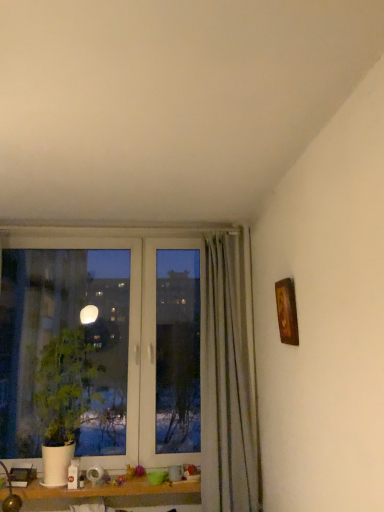
Question: From a real-world perspective, is wooden frame at upper right above or below white matte pot at left?

Choices:
 (A) above
 (B) below

Answer: (A)

Question: Relative to white matte pot at left, is wooden frame at upper right in front or behind?

Choices:
 (A) behind
 (B) front

Answer: (B)

Question: Looking at the image, does wooden frame at upper right seem bigger or smaller compared to white matte pot at left?

Choices:
 (A) small
 (B) big

Answer: (A)

Question: From a real-world perspective, is white matte pot at left physically located above or below wooden frame at upper right?

Choices:
 (A) below
 (B) above

Answer: (A)

Question: From the image's perspective, is white matte pot at left above or below wooden frame at upper right?

Choices:
 (A) above
 (B) below

Answer: (B)

Question: Is white matte pot at left taller or shorter than wooden frame at upper right?

Choices:
 (A) tall
 (B) short

Answer: (A)

Question: Is white matte pot at left spatially inside wooden frame at upper right, or outside of it?

Choices:
 (A) inside
 (B) outside

Answer: (B)